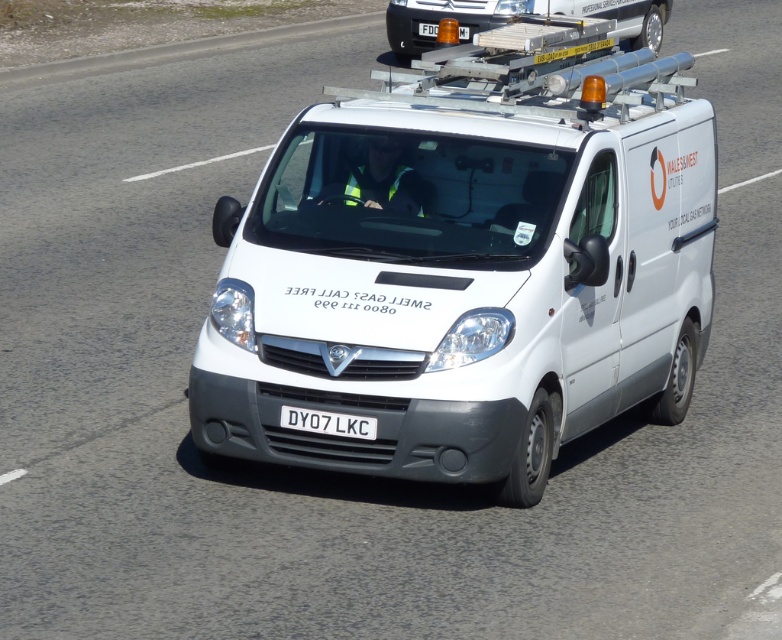
Question: Does white matte van at center have a smaller size compared to white metallic van at center?

Choices:
 (A) yes
 (B) no

Answer: (B)

Question: Which object is farther from the camera taking this photo?

Choices:
 (A) white metallic van at center
 (B) white matte van at center
 (C) white plastic license plate at center

Answer: (A)

Question: Which is farther from the white plastic license plate at center?

Choices:
 (A) white matte van at center
 (B) white metallic van at center

Answer: (B)

Question: Which object is the closest to the white plastic license plate at center?

Choices:
 (A) white matte van at center
 (B) white metallic van at center

Answer: (A)

Question: Is white metallic van at center bigger than white plastic license plate at center?

Choices:
 (A) no
 (B) yes

Answer: (B)

Question: Is white matte van at center bigger than white plastic license plate at center?

Choices:
 (A) no
 (B) yes

Answer: (B)